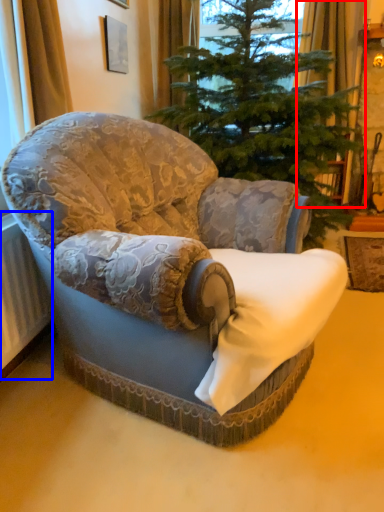
Question: Which object appears farthest to the camera in this image, curtain (highlighted by a red box) or radiator (highlighted by a blue box)?

Choices:
 (A) curtain
 (B) radiator

Answer: (A)